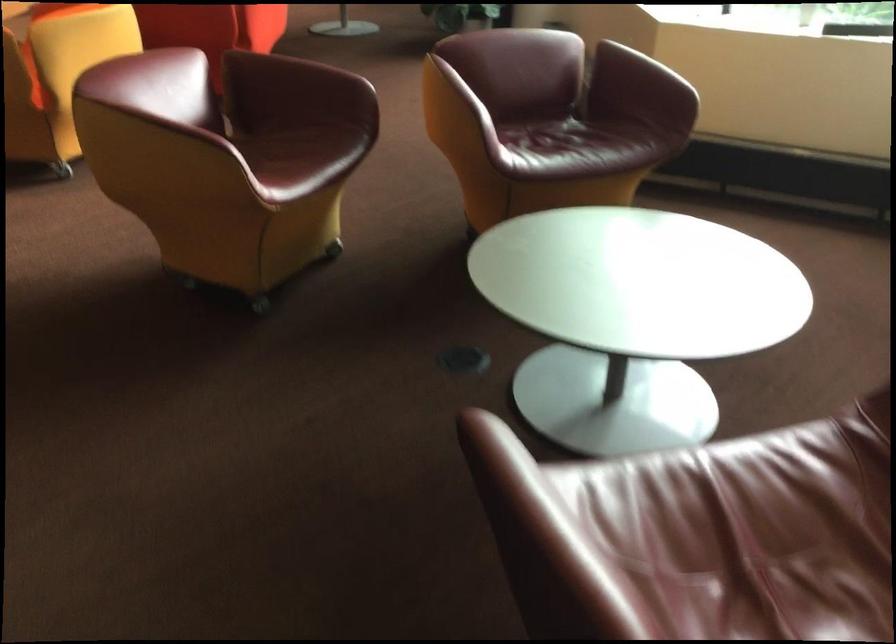
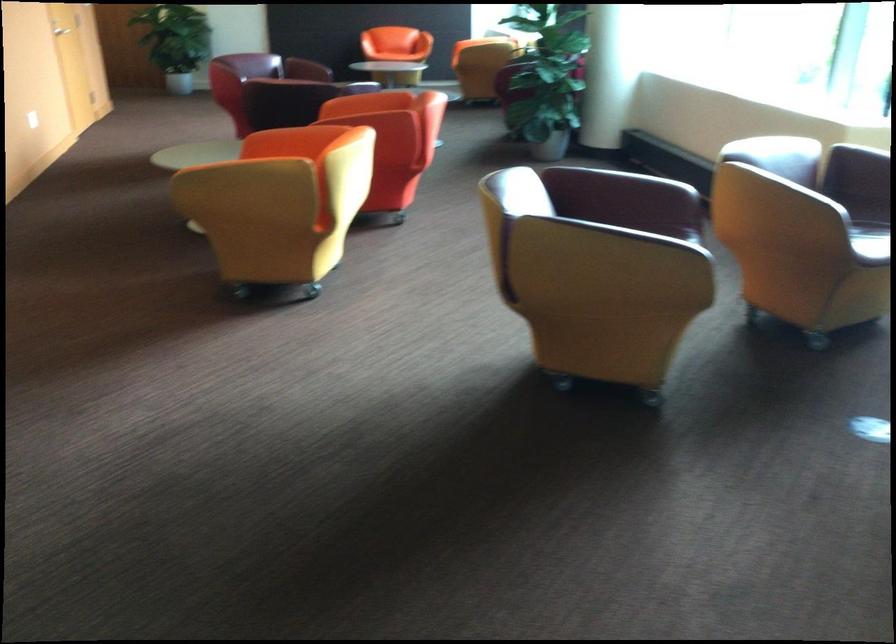
Question: I am providing you with two images of the same scene from different viewpoints. Please identify which objects are invisible in image2.

Choices:
 (A) yellow chair armrest
 (B) red chair armrest
 (C) purple chair sitting surface
 (D) cloth tote bag

Answer: (B)